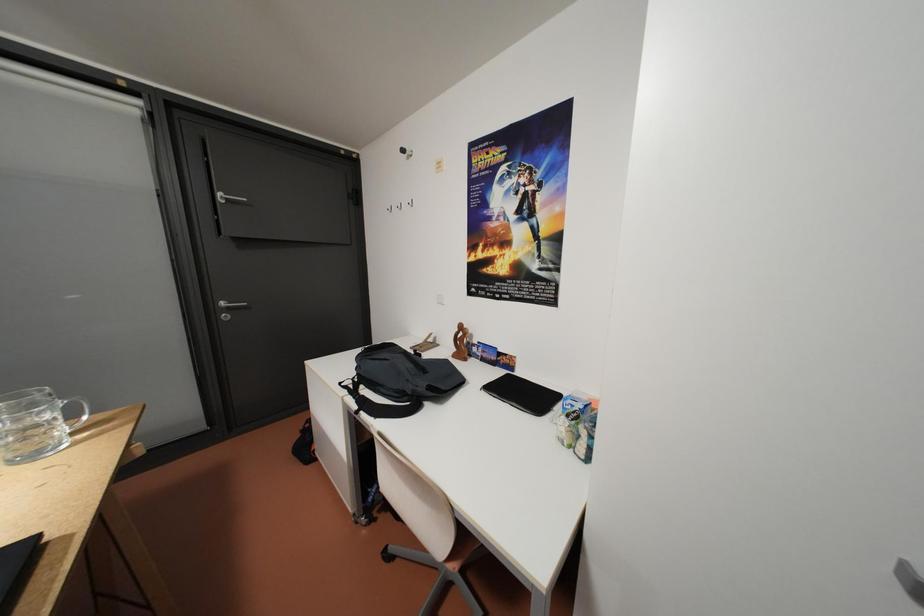
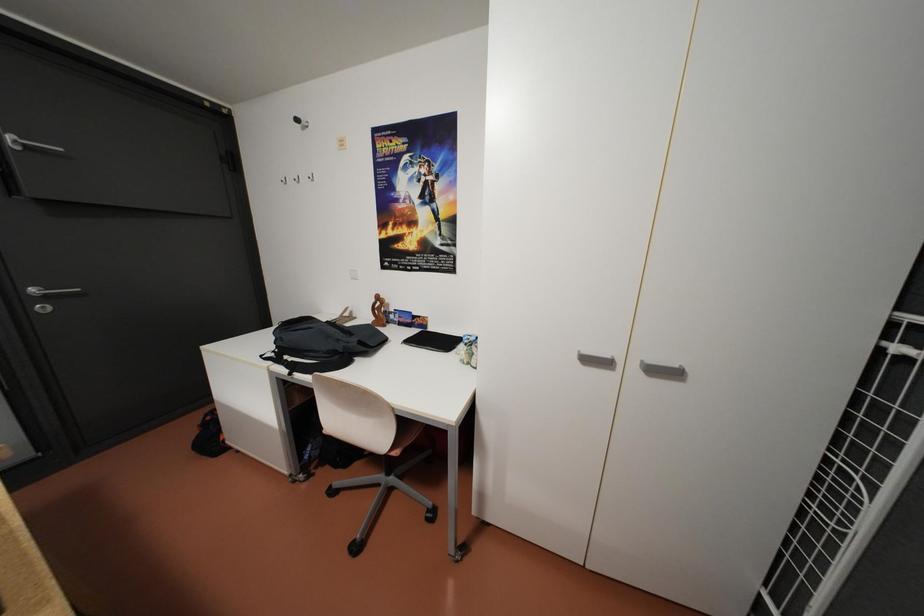
Question: How did the camera likely rotate?

Choices:
 (A) Left
 (B) Right
 (C) Up
 (D) Down

Answer: (B)